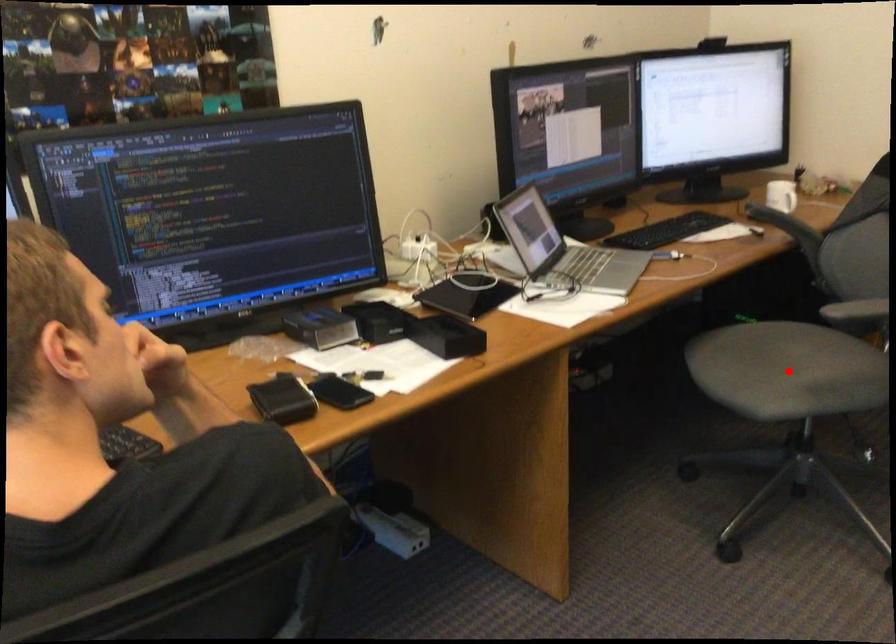
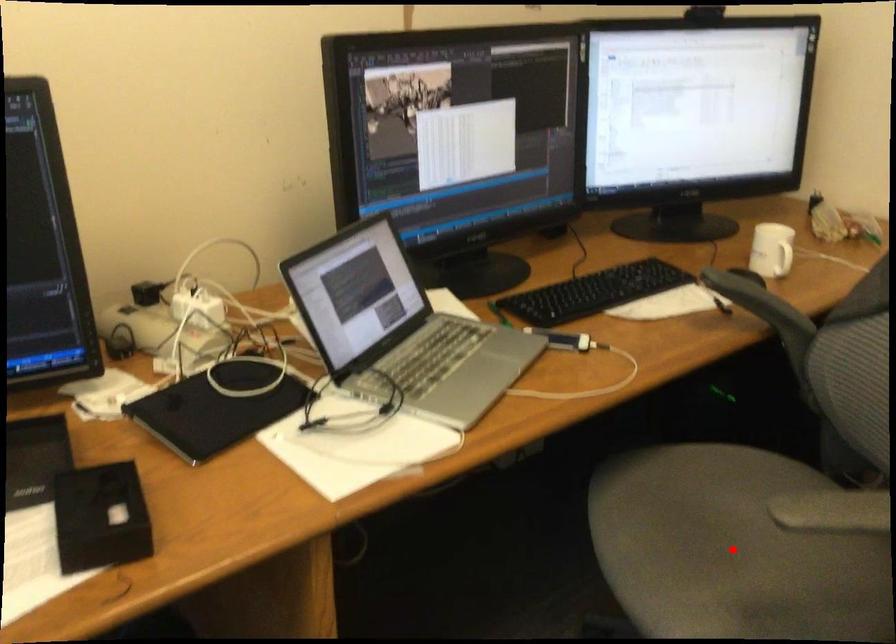
I am providing you with two images of the same scene from different viewpoints. A red point is marked on the first image and another point is marked on the second image. Is the marked point in image1 the same physical position as the marked point in image2?

Yes